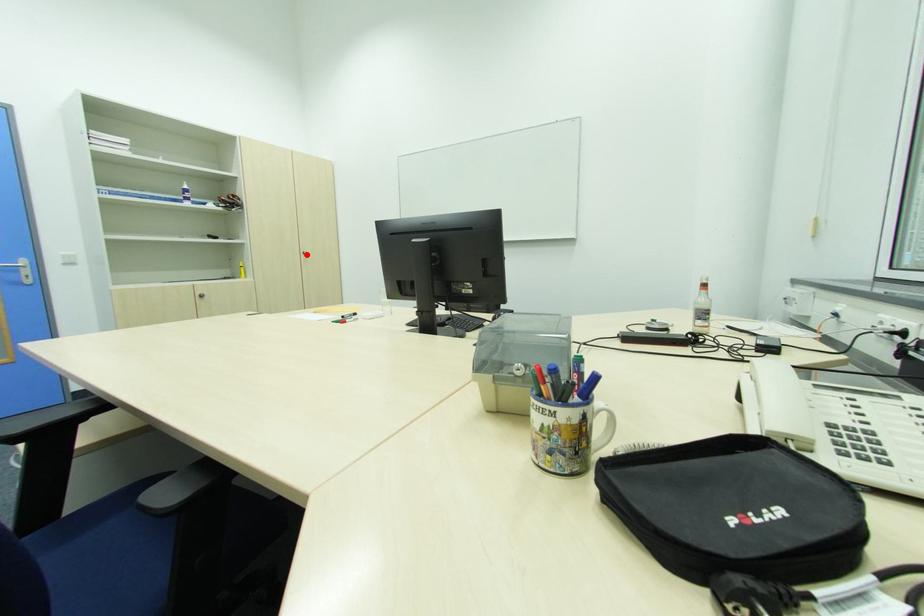
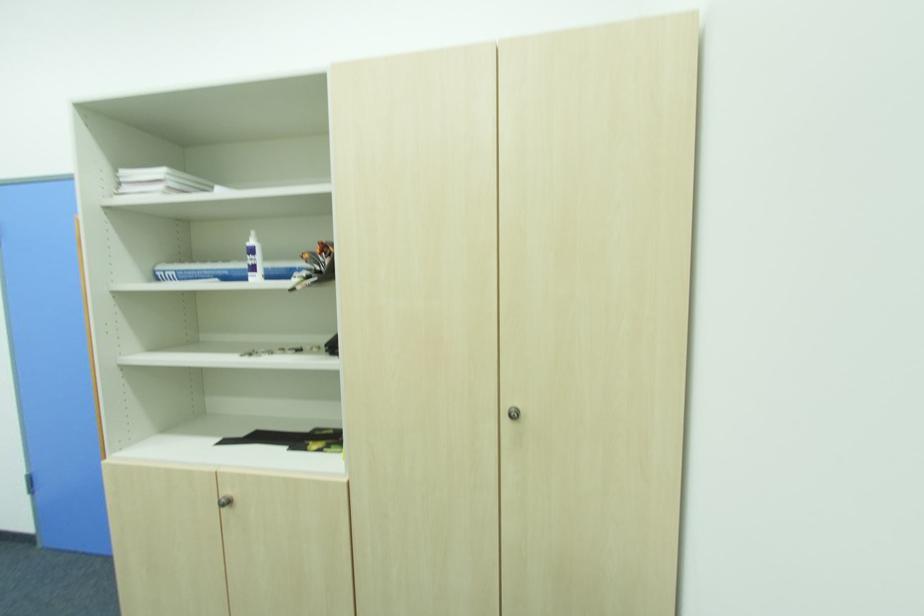
The point at the highlighted location is marked in the first image. Where is the corresponding point in the second image?

(513, 416)